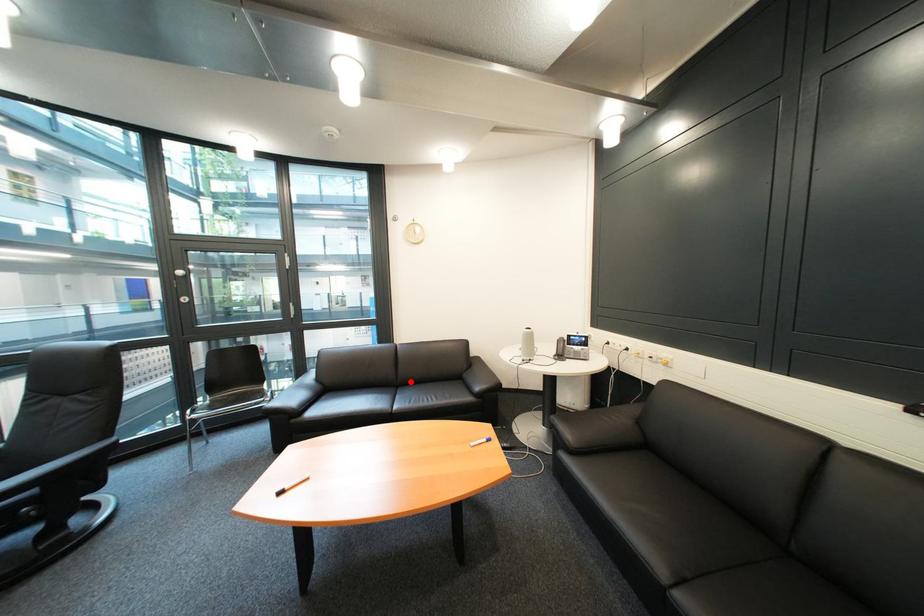
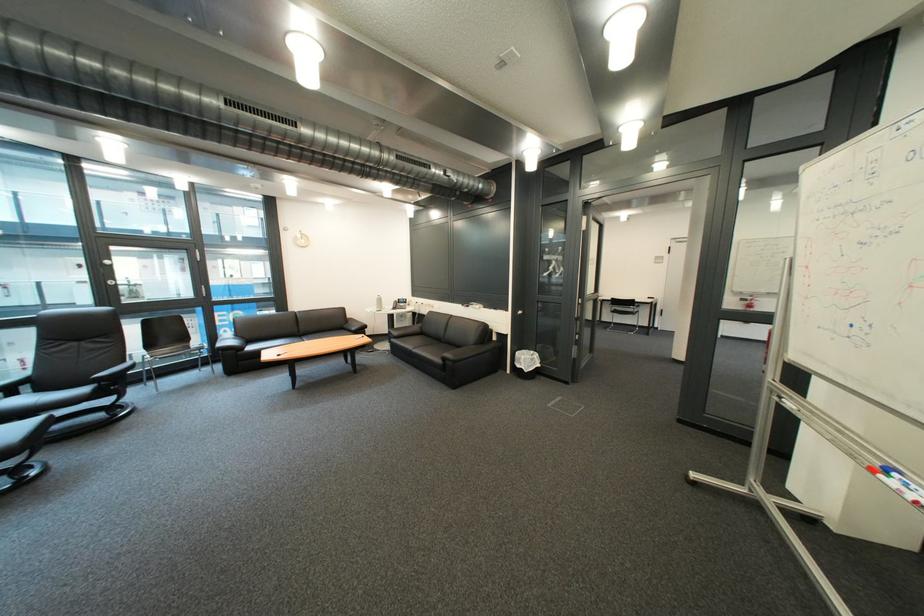
In the second image, find the point that corresponds to the highlighted location in the first image.

(312, 334)